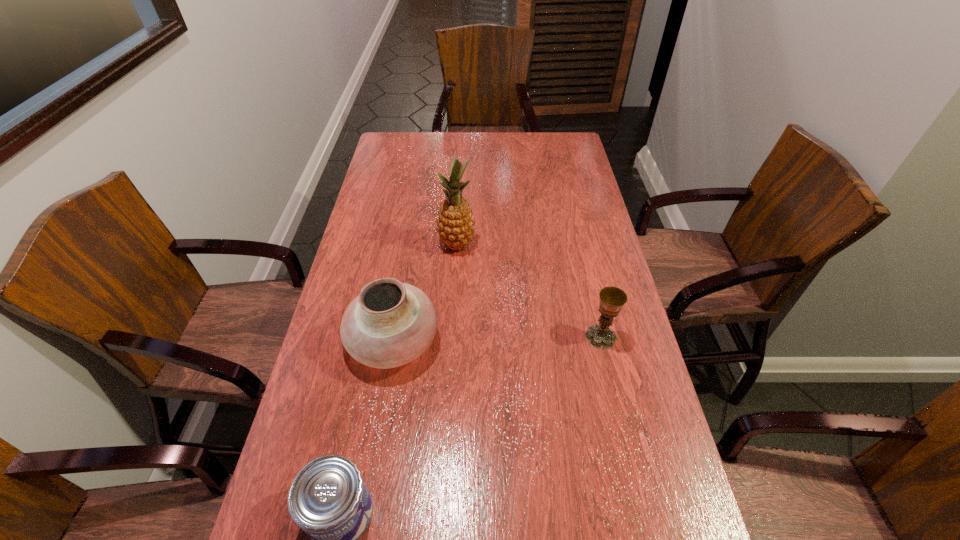
This screenshot has height=540, width=960. I want to click on free space at the far edge of the desktop, so click(x=439, y=159).

In the image, there is a desktop. At what (x,y) coordinates should I click in order to perform the action: click on vacant space at the left edge. Please return your answer as a coordinate pair (x, y). The height and width of the screenshot is (540, 960). Looking at the image, I should click on (358, 223).

In the image, there is a desktop. Identify the location of vacant space at the right edge. This screenshot has height=540, width=960. (604, 411).

Where is `vacant space at the far left corner of the desktop`? vacant space at the far left corner of the desktop is located at coordinates (399, 151).

Where is `vacant space at the far right corner`? Image resolution: width=960 pixels, height=540 pixels. vacant space at the far right corner is located at coordinates (563, 145).

The image size is (960, 540). In order to click on empty location between the pineapple and the pottery in this screenshot , I will do `click(425, 293)`.

Locate an element on the screen. The height and width of the screenshot is (540, 960). blank region between the farthest object and the rightmost object is located at coordinates (529, 291).

Identify the location of empty space between the farthest object and the chalice. (529, 291).

I want to click on empty space between the pottery and the second shortest object, so click(x=497, y=339).

The height and width of the screenshot is (540, 960). In order to click on free space between the pottery and the tallest object in this screenshot , I will do `click(425, 293)`.